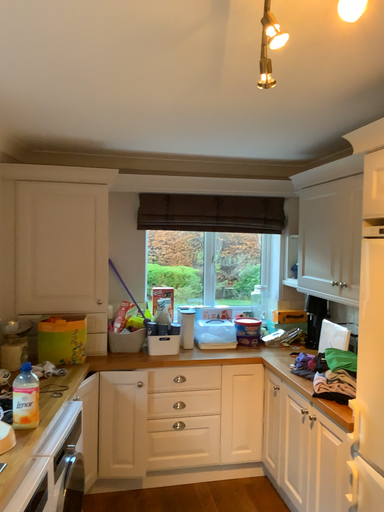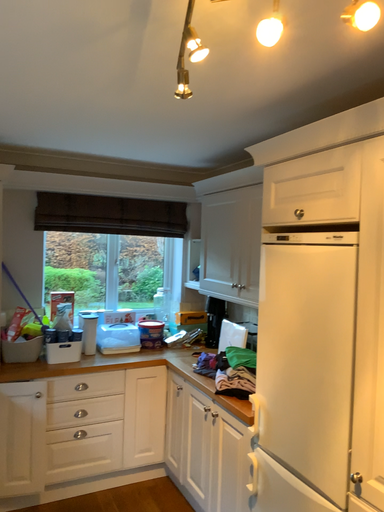
Question: Which way did the camera rotate in the video?

Choices:
 (A) rotated left
 (B) rotated right

Answer: (B)